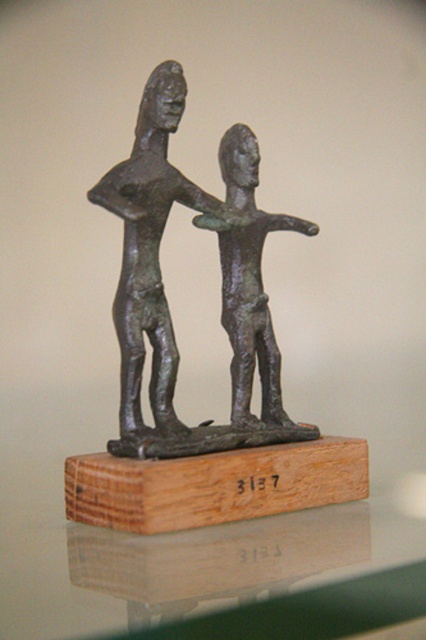
Does transparent glass table at center appear under bronze figure at center?

Yes, transparent glass table at center is below bronze figure at center.

Can you confirm if transparent glass table at center is positioned above bronze figure at center?

No.

Does point (83, 566) come in front of point (230, 186)?

Yes, point (83, 566) is closer to viewer.

The width and height of the screenshot is (426, 640). I want to click on transparent glass table at center, so click(184, 564).

Does transparent glass table at center appear on the right side of bronze statue at center?

Correct, you'll find transparent glass table at center to the right of bronze statue at center.

You are a GUI agent. You are given a task and a screenshot of the screen. Output one action in this format:
    pyautogui.click(x=<x>, y=<y>)
    Task: Click on the transparent glass table at center
    
    Given the screenshot: What is the action you would take?
    pyautogui.click(x=184, y=564)

Which is more to the right, bronze statue at center or bronze figure at center?

bronze figure at center is more to the right.

Describe the element at coordinates (164, 296) in the screenshot. I see `bronze statue at center` at that location.

Who is more distant from viewer, (158, 81) or (239, 369)?

Positioned behind is point (239, 369).

At what (x,y) coordinates should I click in order to perform the action: click on bronze statue at center. Please return your answer as a coordinate pair (x, y). This screenshot has width=426, height=640. Looking at the image, I should click on (164, 296).